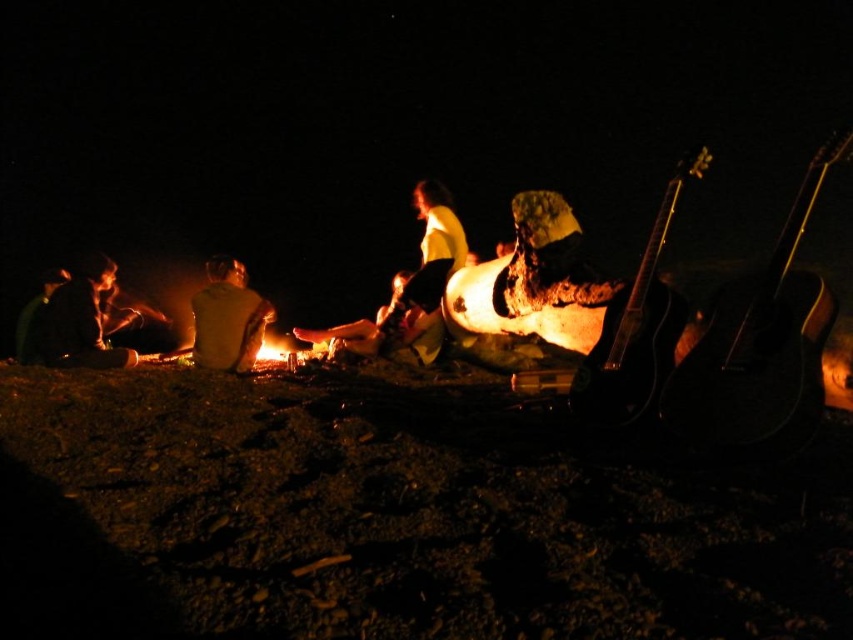
Can you confirm if charcoal gray firewood at lower left is taller than yellow fabric shirt at center?

In fact, charcoal gray firewood at lower left may be shorter than yellow fabric shirt at center.

Which of these two, charcoal gray firewood at lower left or yellow fabric shirt at center, stands shorter?

charcoal gray firewood at lower left is shorter.

Is point (115, 360) behind point (224, 321)?

No, it is not.

At what (x,y) coordinates should I click in order to perform the action: click on charcoal gray firewood at lower left. Please return your answer as a coordinate pair (x, y). Looking at the image, I should click on (79, 321).